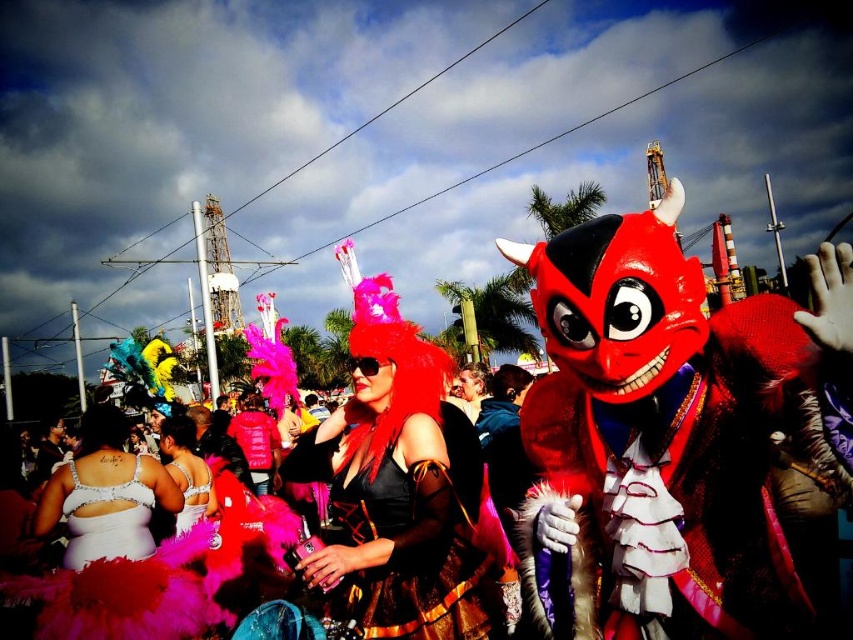
Question: Which of the following is the farthest from the observer?

Choices:
 (A) shiny silver sequins at center
 (B) shiny red devil mask at center
 (C) white sequined bra at center
 (D) shiny silver dress at lower left

Answer: (A)

Question: Is white sequined bra at center positioned in front of shiny silver sequins at center?

Choices:
 (A) yes
 (B) no

Answer: (A)

Question: Estimate the real-world distances between objects in this image. Which object is farther from the satin silver dress at lower left?

Choices:
 (A) shiny silver dress at lower left
 (B) shiny silver sequins at center
 (C) shiny red devil mask at center
 (D) white sequined bra at center

Answer: (C)

Question: Does satin silver dress at lower left have a lesser width compared to shiny silver sequins at center?

Choices:
 (A) no
 (B) yes

Answer: (A)

Question: Which point is closer to the camera?

Choices:
 (A) (456, 509)
 (B) (767, 589)
 (C) (74, 484)
 (D) (196, 488)

Answer: (B)

Question: Is shiny red devil mask at center bigger than shiny silver sequins at center?

Choices:
 (A) no
 (B) yes

Answer: (B)